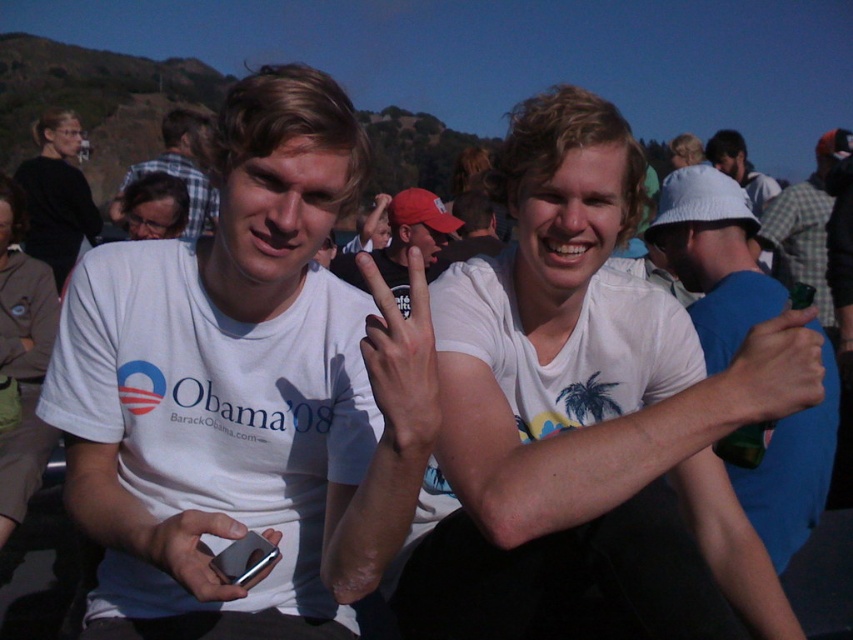
You are a photographer at the event and need to capture a photo that includes both the plaid shirt at center and the matte black glasses at upper left. Which object should you frame first to ensure both fit in the shot?

The plaid shirt at center is wider than the matte black glasses at upper left, so you should frame the plaid shirt at center first to ensure both fit in the shot.

You are at a social event and want to take a photo of the plaid shirt at center and the light brown hair at upper center. Which one should you focus on first if you want to capture both in one frame?

Since the plaid shirt at center is to the left of light brown hair at upper center, you should focus on the plaid shirt at center first as it is positioned to the left, allowing both subjects to be captured in the frame when centered appropriately.